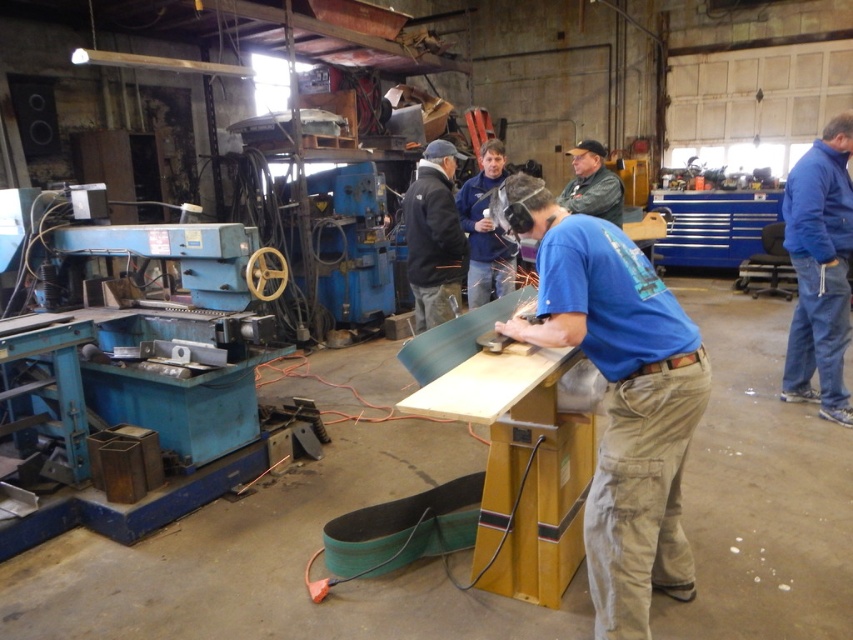
You are standing in the workshop and see two points marked in the image. Which point, point (422,198) or point (605,195), is closer to you?

Point (422,198) is closer to the viewer than point (605,195).

In the workshop scene, there are two objects labeled as the blue cotton shirt at center and the blue shirt at center. Which one is taller?

The blue cotton shirt at center is taller than the blue shirt at center.